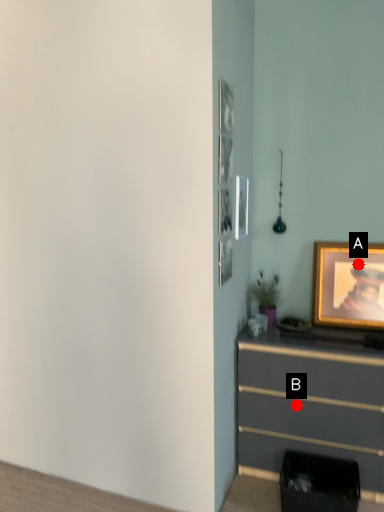
Question: Two points are circled on the image, labeled by A and B beside each circle. Which point is closer to the camera taking this photo?

Choices:
 (A) A is closer
 (B) B is closer

Answer: (B)